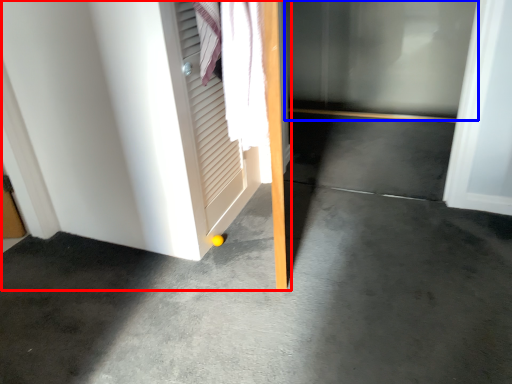
Question: Among these objects, which one is farthest to the camera, door (highlighted by a red box) or glass door (highlighted by a blue box)?

Choices:
 (A) door
 (B) glass door

Answer: (B)